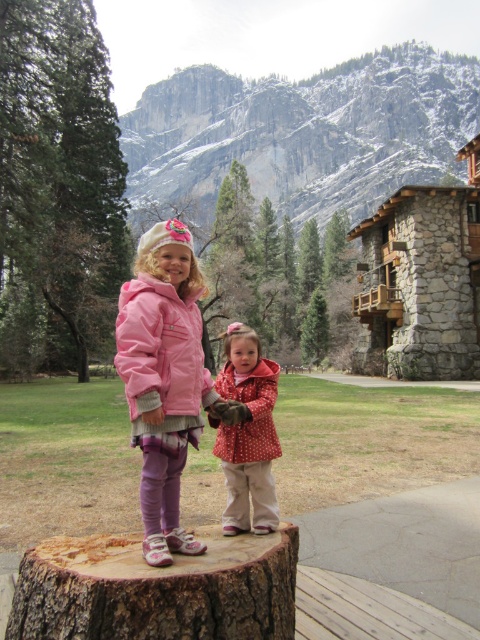
Question: Can you confirm if matte pink jacket at center is positioned below polka dot fabric coat at center?

Choices:
 (A) yes
 (B) no

Answer: (B)

Question: Is brown rough tree stump at lower center positioned before polka dot fabric jacket at center?

Choices:
 (A) yes
 (B) no

Answer: (A)

Question: Which object is closer to the camera taking this photo?

Choices:
 (A) polka dot fabric coat at center
 (B) polka dot fabric jacket at center
 (C) brown rough tree stump at lower center
 (D) pink fleece jacket at center

Answer: (C)

Question: Which point is farther from the camera taking this photo?

Choices:
 (A) (124, 344)
 (B) (286, 561)
 (C) (192, 353)
 (D) (242, 461)

Answer: (D)

Question: Considering the relative positions of brown rough tree stump at lower center and pink fleece jacket at center in the image provided, where is brown rough tree stump at lower center located with respect to pink fleece jacket at center?

Choices:
 (A) right
 (B) left

Answer: (A)

Question: Which point is closer to the camera taking this photo?

Choices:
 (A) (264, 420)
 (B) (170, 365)
 (C) (262, 387)
 (D) (215, 536)

Answer: (D)